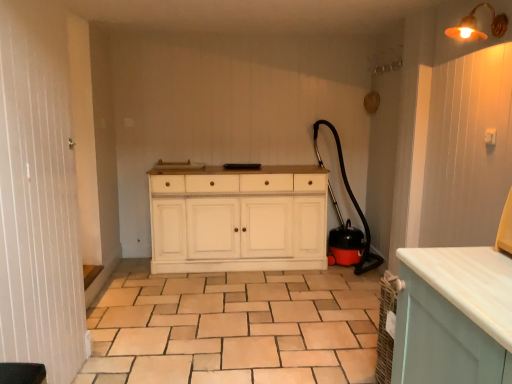
Question: Can you confirm if black rubber garden hose at right is thinner than beige ceramic tile at center?

Choices:
 (A) no
 (B) yes

Answer: (B)

Question: From the image's perspective, is black rubber garden hose at right located beneath beige ceramic tile at center?

Choices:
 (A) yes
 (B) no

Answer: (B)

Question: Is black rubber garden hose at right to the left of beige ceramic tile at center from the viewer's perspective?

Choices:
 (A) no
 (B) yes

Answer: (A)

Question: Does black rubber garden hose at right have a lesser height compared to beige ceramic tile at center?

Choices:
 (A) yes
 (B) no

Answer: (B)

Question: Is black rubber garden hose at right in front of beige ceramic tile at center?

Choices:
 (A) no
 (B) yes

Answer: (A)

Question: Is white wood screen door at left wider or thinner than metallic brass light fixture at upper right?

Choices:
 (A) thin
 (B) wide

Answer: (A)

Question: Considering the relative positions of white wood screen door at left and metallic brass light fixture at upper right in the image provided, is white wood screen door at left to the left or to the right of metallic brass light fixture at upper right?

Choices:
 (A) right
 (B) left

Answer: (B)

Question: From the image's perspective, is white wood screen door at left above or below metallic brass light fixture at upper right?

Choices:
 (A) below
 (B) above

Answer: (A)

Question: In the image, is white wood screen door at left positioned in front of or behind metallic brass light fixture at upper right?

Choices:
 (A) front
 (B) behind

Answer: (A)

Question: Considering their positions, is black rubber garden hose at right located in front of or behind beige ceramic tile at center?

Choices:
 (A) behind
 (B) front

Answer: (A)

Question: From the image's perspective, relative to beige ceramic tile at center, is black rubber garden hose at right above or below?

Choices:
 (A) above
 (B) below

Answer: (A)

Question: From a real-world perspective, is black rubber garden hose at right above or below beige ceramic tile at center?

Choices:
 (A) below
 (B) above

Answer: (B)

Question: In terms of height, does black rubber garden hose at right look taller or shorter compared to beige ceramic tile at center?

Choices:
 (A) short
 (B) tall

Answer: (B)

Question: Visually, is metallic brass light fixture at upper right positioned to the left or to the right of white wood screen door at left?

Choices:
 (A) right
 (B) left

Answer: (A)

Question: Considering the positions of point pyautogui.click(x=464, y=26) and point pyautogui.click(x=56, y=0), is point pyautogui.click(x=464, y=26) closer or farther from the camera than point pyautogui.click(x=56, y=0)?

Choices:
 (A) closer
 (B) farther

Answer: (B)